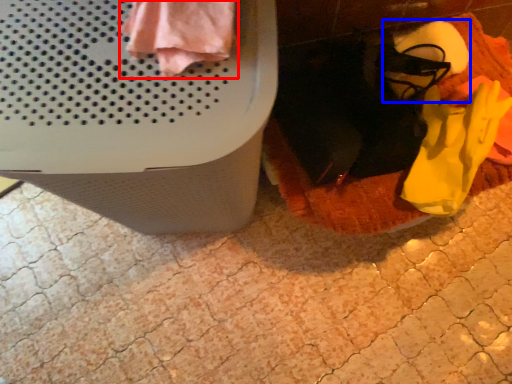
Question: Which object is closer to the camera taking this photo, clothing (highlighted by a red box) or footwear (highlighted by a blue box)?

Choices:
 (A) clothing
 (B) footwear

Answer: (A)